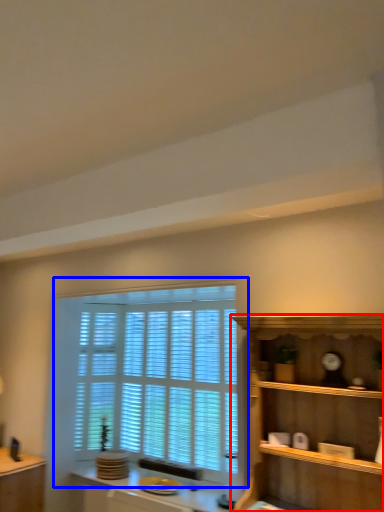
Question: Which point is closer to the camera, shelf (highlighted by a red box) or window (highlighted by a blue box)?

Choices:
 (A) shelf
 (B) window

Answer: (A)